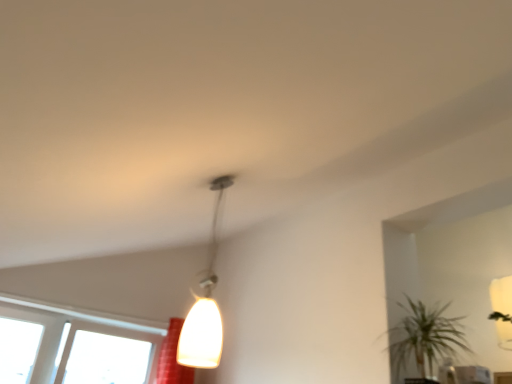
Question: In terms of width, does transparent glass window at lower left look wider or thinner when compared to white glossy pendant light at center?

Choices:
 (A) thin
 (B) wide

Answer: (B)

Question: Is transparent glass window at lower left in front of or behind white glossy pendant light at center in the image?

Choices:
 (A) behind
 (B) front

Answer: (A)

Question: Based on their relative distances, which object is nearer to the white glossy pendant light at center?

Choices:
 (A) green leafy plant at lower right
 (B) transparent glass window at lower left

Answer: (A)

Question: Which object is positioned farthest from the white glossy pendant light at center?

Choices:
 (A) green leafy plant at lower right
 (B) transparent glass window at lower left

Answer: (B)